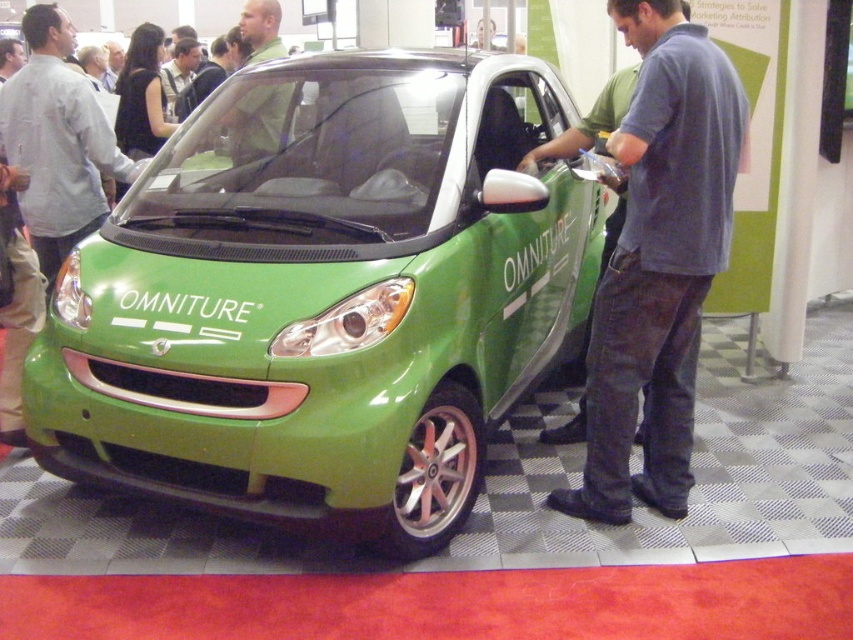
Question: Which object is closer to the camera taking this photo?

Choices:
 (A) denim jeans at center
 (B) green glossy car at center
 (C) green matte shirt at center

Answer: (B)

Question: Which object is positioned farthest from the matte gray shirt at center?

Choices:
 (A) denim jeans at center
 (B) green glossy car at center
 (C) light brown leather jacket at upper center
 (D) green matte shirt at center

Answer: (A)

Question: Does denim jeans at center appear on the right side of green matte shirt at center?

Choices:
 (A) yes
 (B) no

Answer: (A)

Question: Does matte gray shirt at center have a larger size compared to green matte shirt at center?

Choices:
 (A) yes
 (B) no

Answer: (A)

Question: Which point appears farthest from the camera in this image?

Choices:
 (A) (671, 321)
 (B) (560, 339)
 (C) (167, 76)
 (D) (84, 220)

Answer: (C)

Question: Is green glossy car at center to the left of light brown leather jacket at upper center from the viewer's perspective?

Choices:
 (A) yes
 (B) no

Answer: (B)